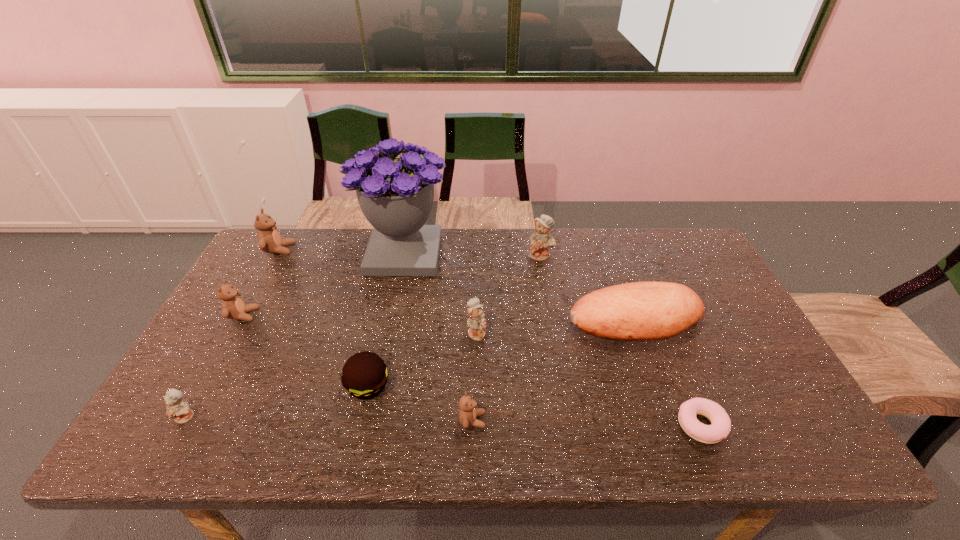
Locate an element on the screen. The image size is (960, 540). the smallest blue teddy bear is located at coordinates (176, 408).

The image size is (960, 540). What are the coordinates of `the nearest blue teddy bear` in the screenshot? It's located at (176, 408).

The image size is (960, 540). In order to click on the rightmost brown teddy bear in this screenshot , I will do `click(467, 415)`.

This screenshot has width=960, height=540. What are the coordinates of `the nearest brown teddy bear` in the screenshot? It's located at (467, 415).

Where is `doughnut`? doughnut is located at coordinates (720, 427).

Find the location of a particular element. The height and width of the screenshot is (540, 960). the shortest object is located at coordinates (720, 427).

Find the location of a particular element. The height and width of the screenshot is (540, 960). vacant space positioned 0.120m on the right of the tallest object is located at coordinates (487, 254).

Where is `free location located 0.210m on the front-facing side of the biggest brown teddy bear`? free location located 0.210m on the front-facing side of the biggest brown teddy bear is located at coordinates (356, 250).

What are the coordinates of `free space located 0.310m on the front-facing side of the biggest blue teddy bear` in the screenshot? It's located at (554, 334).

The width and height of the screenshot is (960, 540). Identify the location of vacant space located on the front-facing side of the second nearest blue teddy bear. (608, 333).